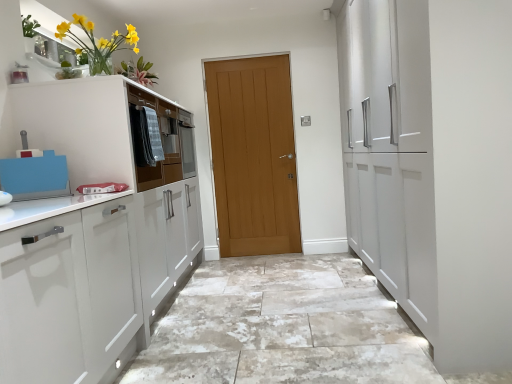
Question: Is light brown wooden door at center surrounded by marble-like granite floor at center?

Choices:
 (A) yes
 (B) no

Answer: (B)

Question: Considering the relative positions of marble-like granite floor at center and light brown wooden door at center in the image provided, is marble-like granite floor at center to the left of light brown wooden door at center from the viewer's perspective?

Choices:
 (A) yes
 (B) no

Answer: (B)

Question: Does marble-like granite floor at center have a greater width compared to light brown wooden door at center?

Choices:
 (A) no
 (B) yes

Answer: (B)

Question: Is marble-like granite floor at center taller than light brown wooden door at center?

Choices:
 (A) no
 (B) yes

Answer: (A)

Question: Can you confirm if marble-like granite floor at center is shorter than light brown wooden door at center?

Choices:
 (A) no
 (B) yes

Answer: (B)

Question: Considering the positions of matte brown drawer at center and yellow glass vase at upper left in the image, is matte brown drawer at center bigger or smaller than yellow glass vase at upper left?

Choices:
 (A) small
 (B) big

Answer: (B)

Question: From a real-world perspective, is matte brown drawer at center above or below yellow glass vase at upper left?

Choices:
 (A) below
 (B) above

Answer: (A)

Question: Choose the correct answer: Is matte brown drawer at center inside yellow glass vase at upper left or outside it?

Choices:
 (A) outside
 (B) inside

Answer: (A)

Question: Considering their positions, is matte brown drawer at center located in front of or behind yellow glass vase at upper left?

Choices:
 (A) front
 (B) behind

Answer: (B)

Question: Is yellow glass vase at upper left inside the boundaries of matte brown drawer at center, or outside?

Choices:
 (A) outside
 (B) inside

Answer: (A)

Question: Considering the positions of yellow glass vase at upper left and matte brown drawer at center in the image, is yellow glass vase at upper left wider or thinner than matte brown drawer at center?

Choices:
 (A) thin
 (B) wide

Answer: (B)

Question: In terms of size, does yellow glass vase at upper left appear bigger or smaller than matte brown drawer at center?

Choices:
 (A) big
 (B) small

Answer: (B)

Question: Visually, is yellow glass vase at upper left positioned to the left or to the right of matte brown drawer at center?

Choices:
 (A) right
 (B) left

Answer: (B)

Question: Is matte brown drawer at center to the left or to the right of marble-like granite floor at center in the image?

Choices:
 (A) right
 (B) left

Answer: (B)

Question: Is matte brown drawer at center wider or thinner than marble-like granite floor at center?

Choices:
 (A) thin
 (B) wide

Answer: (A)